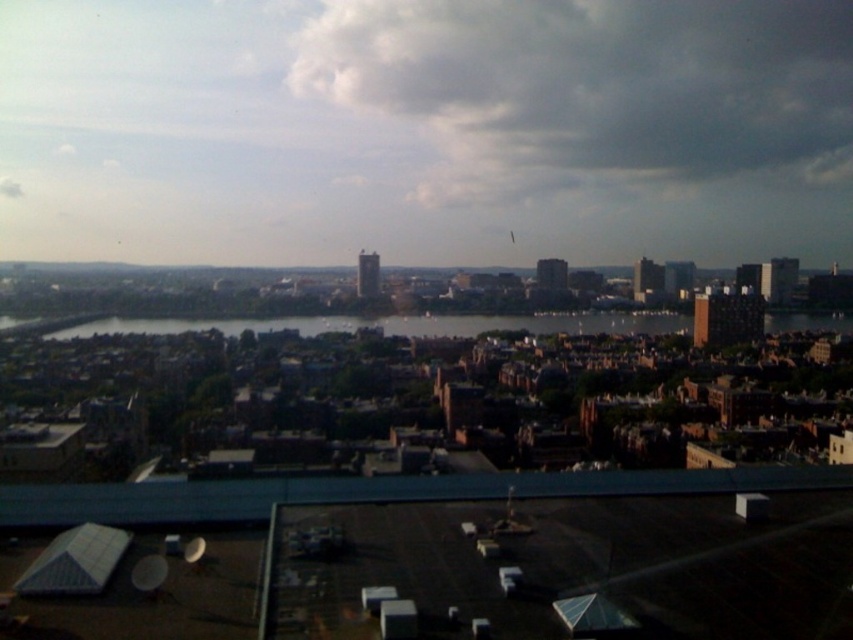
Which is above, white fluffy cloud at upper center or dark blue water at center?

white fluffy cloud at upper center is above.

Between point (718, 4) and point (606, 324), which one is positioned behind?

The point (718, 4) is behind.

Locate an element on the screen. The height and width of the screenshot is (640, 853). white fluffy cloud at upper center is located at coordinates (595, 88).